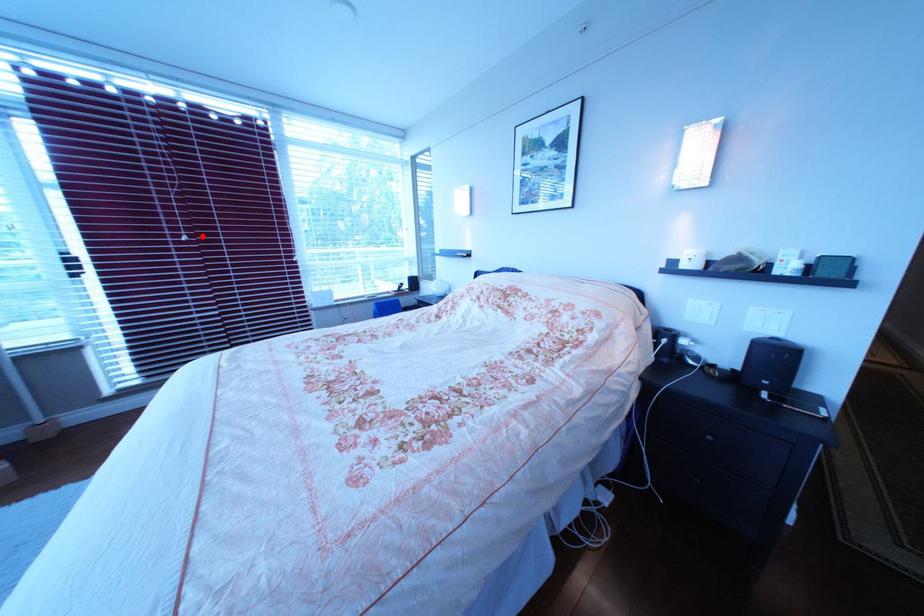
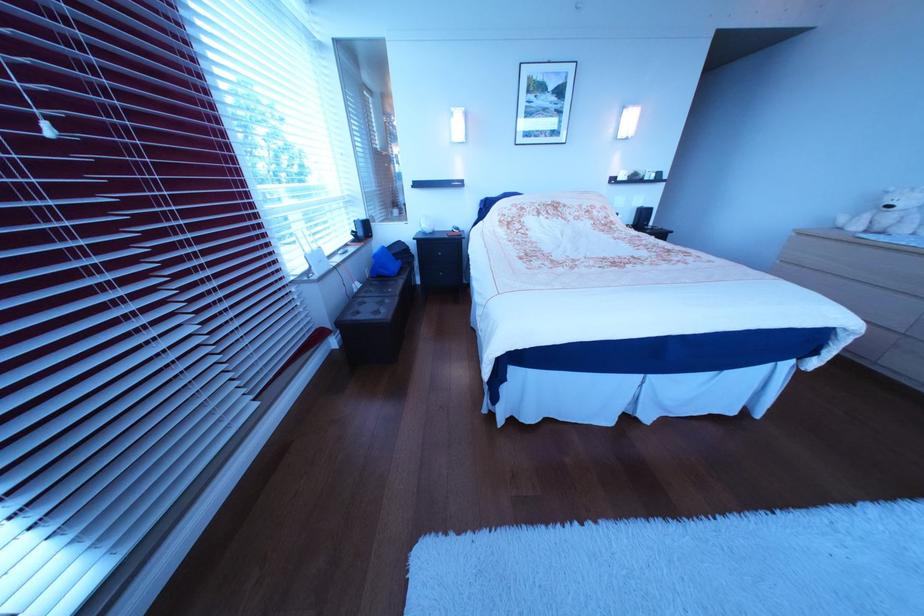
In the second image, find the point that corresponds to the highlighted location in the first image.

(63, 120)